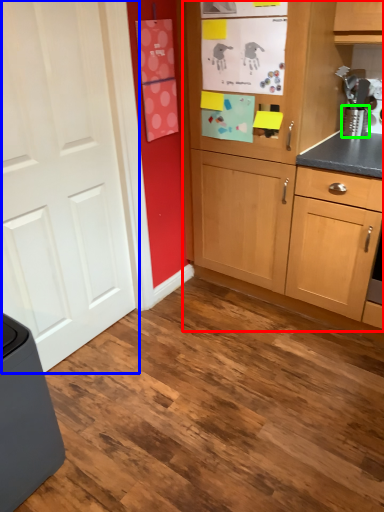
Question: Considering the real-world distances, which object is farthest from cabinetry (highlighted by a red box)? door (highlighted by a blue box) or appliance (highlighted by a green box)?

Choices:
 (A) door
 (B) appliance

Answer: (A)